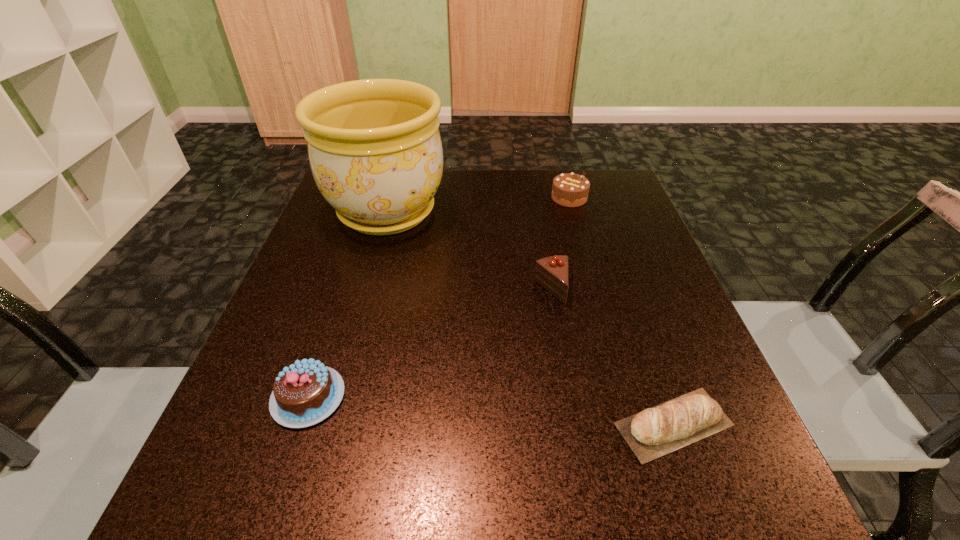
Find the location of a particular element. The height and width of the screenshot is (540, 960). flowerpot is located at coordinates pos(375,151).

You are a GUI agent. You are given a task and a screenshot of the screen. Output one action in this format:
    pyautogui.click(x=<x>, y=<y>)
    Task: Click on the rightmost chocolate cake
    
    Given the screenshot: What is the action you would take?
    click(x=569, y=190)

Find the location of a particular element. the second farthest chocolate cake is located at coordinates (552, 273).

This screenshot has width=960, height=540. I want to click on the third nearest object, so click(552, 273).

In order to click on the leftmost chocolate cake in this screenshot , I will do `click(306, 392)`.

This screenshot has height=540, width=960. I want to click on the shortest object, so click(696, 414).

Locate an element on the screen. The height and width of the screenshot is (540, 960). free location located on the front of the flowerpot is located at coordinates (369, 276).

You are a GUI agent. You are given a task and a screenshot of the screen. Output one action in this format:
    pyautogui.click(x=<x>, y=<y>)
    Task: Click on the vacant position located 0.300m on the front of the rightmost chocolate cake
    Image resolution: width=960 pixels, height=540 pixels.
    Given the screenshot: What is the action you would take?
    pyautogui.click(x=595, y=292)

Locate an element on the screen. This screenshot has width=960, height=540. vacant space located on the front of the second chocolate cake from right to left is located at coordinates (579, 444).

This screenshot has width=960, height=540. In order to click on free space located 0.360m on the right of the nearest chocolate cake in this screenshot , I will do `click(572, 397)`.